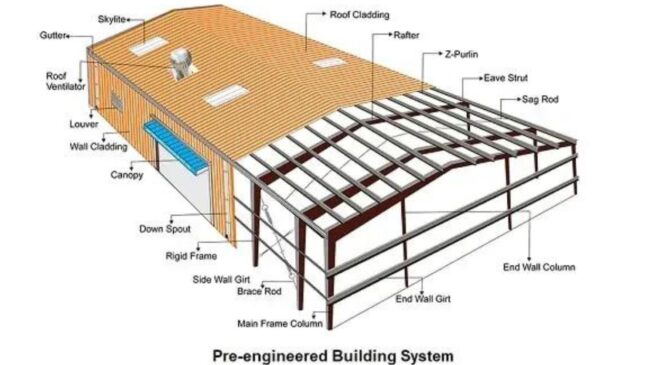
In order to click on door in this screenshot , I will do `click(162, 193)`.